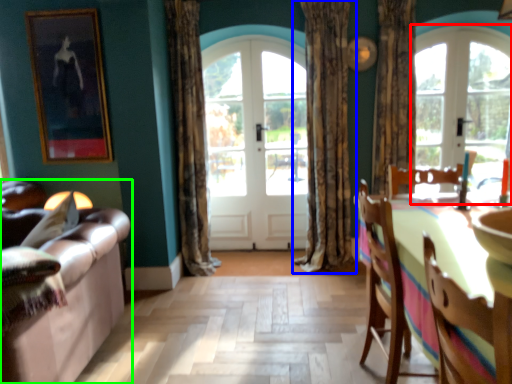
Question: Considering the real-world distances, which object is farthest from window (highlighted by a red box)? curtain (highlighted by a blue box) or studio couch (highlighted by a green box)?

Choices:
 (A) curtain
 (B) studio couch

Answer: (B)